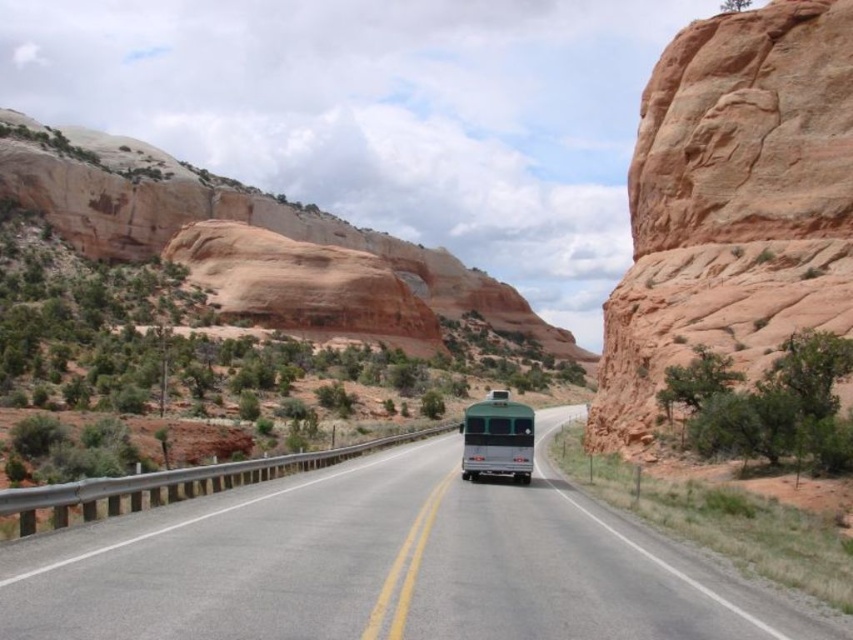
Question: Which is farther from the rustic sandstone cliff at right?

Choices:
 (A) rustic sandstone arch at upper center
 (B) green matte bus at center
 (C) green metallic bus at center

Answer: (A)

Question: Can you confirm if rustic sandstone cliff at right is thinner than rustic sandstone arch at upper center?

Choices:
 (A) no
 (B) yes

Answer: (B)

Question: Can you confirm if green metallic bus at center is bigger than green matte bus at center?

Choices:
 (A) no
 (B) yes

Answer: (A)

Question: Estimate the real-world distances between objects in this image. Which object is closer to the rustic sandstone cliff at right?

Choices:
 (A) rustic sandstone arch at upper center
 (B) green metallic bus at center

Answer: (B)

Question: Can you confirm if green metallic bus at center is bigger than green matte bus at center?

Choices:
 (A) no
 (B) yes

Answer: (A)

Question: Which of the following is the closest to the observer?

Choices:
 (A) rustic sandstone cliff at right
 (B) green metallic bus at center

Answer: (B)